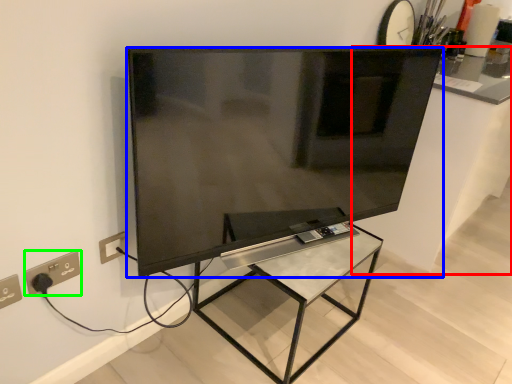
Question: Estimate the real-world distances between objects in this image. Which object is farther from counter top (highlighted by a red box), television (highlighted by a blue box) or power plugs and sockets (highlighted by a green box)?

Choices:
 (A) television
 (B) power plugs and sockets

Answer: (B)